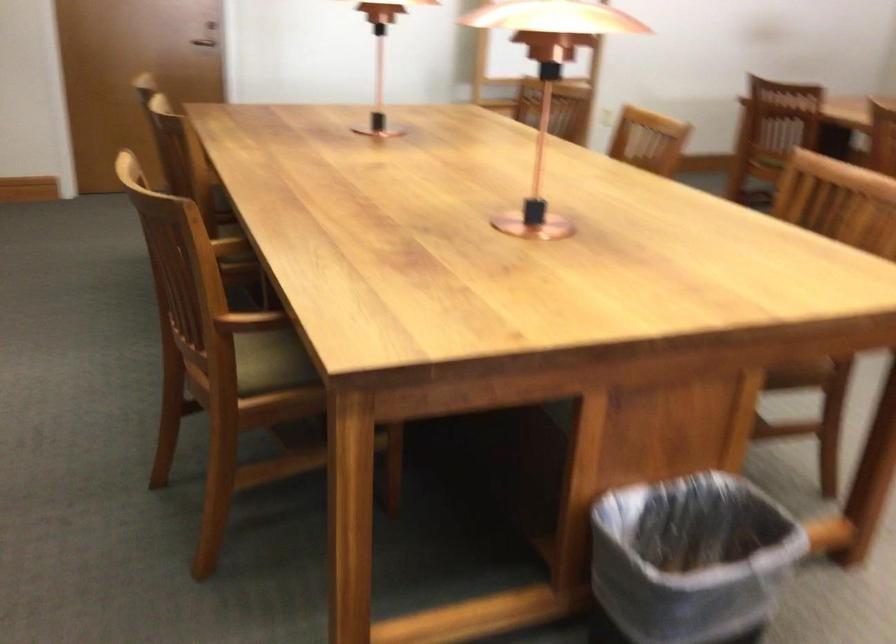
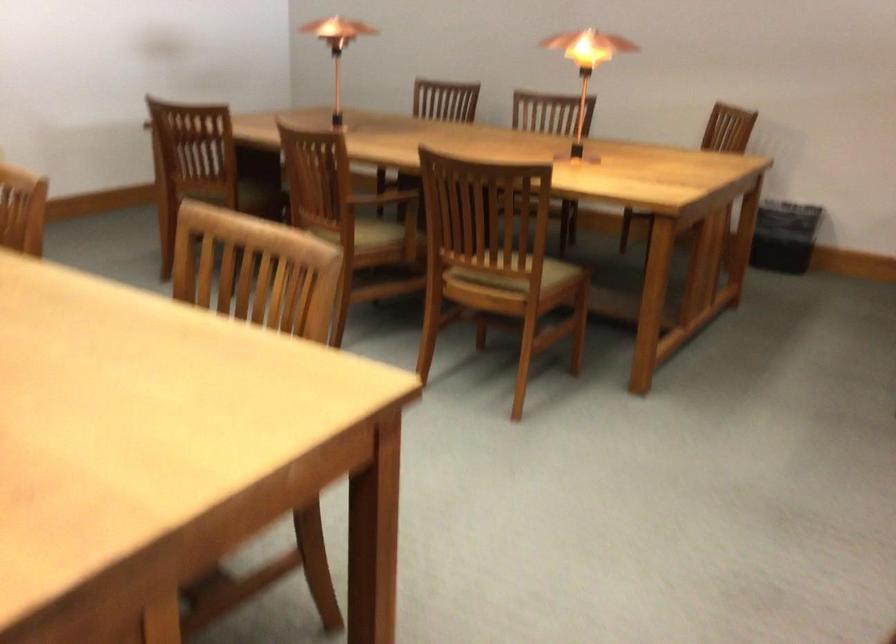
Question: The first image is from the beginning of the video and the second image is from the end. How did the camera likely rotate when shooting the video?

Choices:
 (A) Left
 (B) Right
 (C) Up
 (D) Down

Answer: (B)